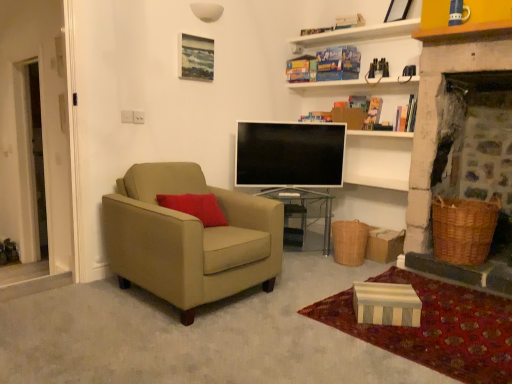
Identify the location of free location in front of transparent glass table at center. (313, 269).